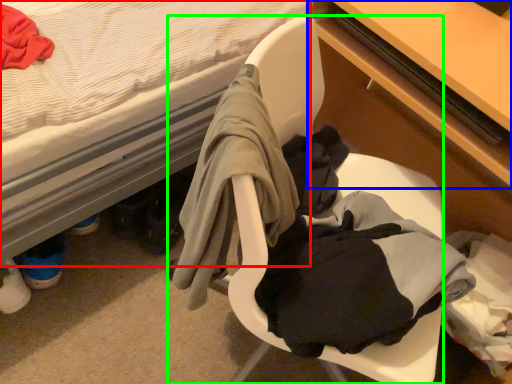
Question: Based on their relative distances, which object is nearer to bed (highlighted by a red box)? Choose from table (highlighted by a blue box) and chair (highlighted by a green box).

Choices:
 (A) table
 (B) chair

Answer: (B)